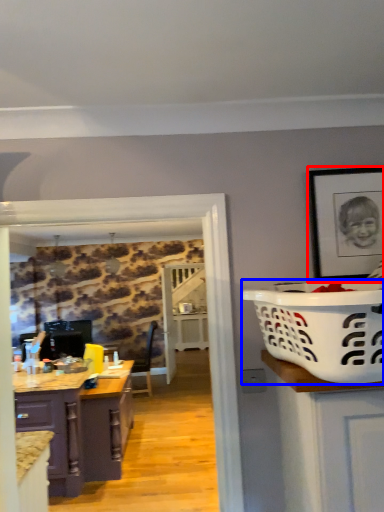
Question: Which object appears closest to the camera in this image, picture frame (highlighted by a red box) or basket container (highlighted by a blue box)?

Choices:
 (A) picture frame
 (B) basket container

Answer: (B)